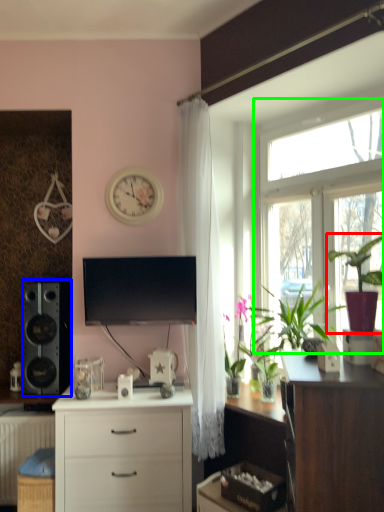
Question: Which object is positioned closest to houseplant (highlighted by a red box)? Select from loudspeaker (highlighted by a blue box) and window (highlighted by a green box).

Choices:
 (A) loudspeaker
 (B) window

Answer: (B)